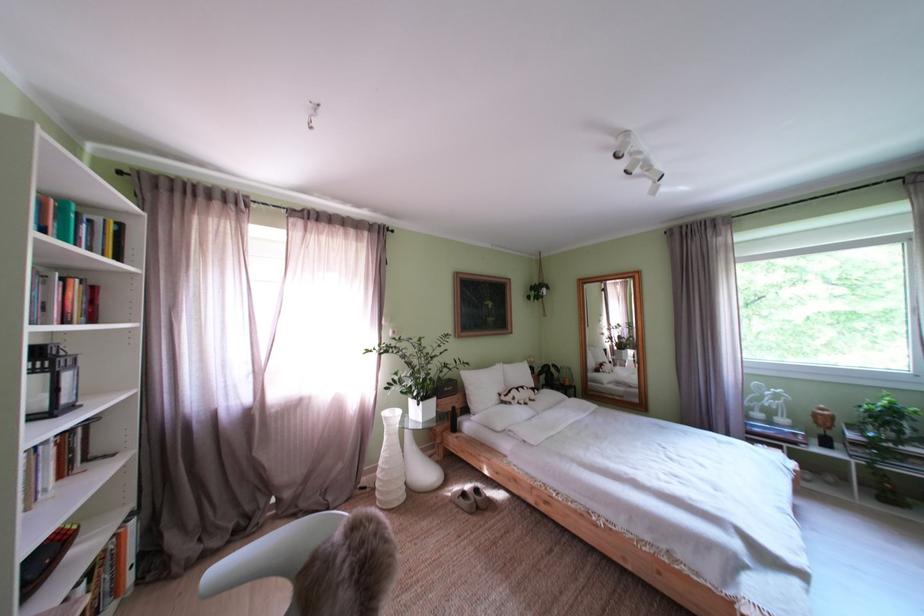
Find the location of a particular element. The image size is (924, 616). book on shelf is located at coordinates (67, 301).